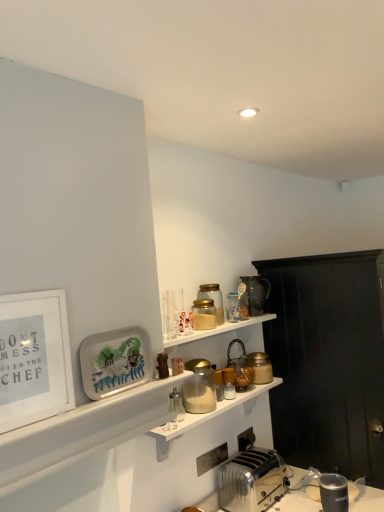
Question: Is black wood cabinet at right wider or thinner than matte gold jar at upper right, the second appliance from the back?

Choices:
 (A) wide
 (B) thin

Answer: (A)

Question: Is black wood cabinet at right in front of or behind matte gold jar at upper right, the second appliance from the back, in the image?

Choices:
 (A) front
 (B) behind

Answer: (A)

Question: Based on their relative distances, which object is farther from the matte glass jars at center, the 3th shelf from the top?

Choices:
 (A) matte plastic tray at lower left, which is the 2th picture frame from left to right
 (B) white matte picture frame at left, the 2th picture frame positioned from the back
 (C) white glossy shelf at lower left, the second shelf in the top-to-bottom sequence
 (D) silver metallic toaster at lower center
 (E) matte brown jug at upper right, which is the first appliance from back to front

Answer: (B)

Question: Estimate the real-world distances between objects in this image. Which object is farther from the white glossy shelf at lower left, marked as the second shelf in a bottom-to-top arrangement?

Choices:
 (A) translucent glass jar at upper center, placed as the sixth appliance when sorted from front to back
 (B) metallic gold jar at upper center, which is counted as the third shelf, starting from the bottom
 (C) matte gold jar at upper right, the second appliance from the back
 (D) matte brown jug at upper right, the 10th appliance viewed from the front
 (E) brown leather wallet at upper center, which appears as the 10th appliance when viewed from the back

Answer: (D)